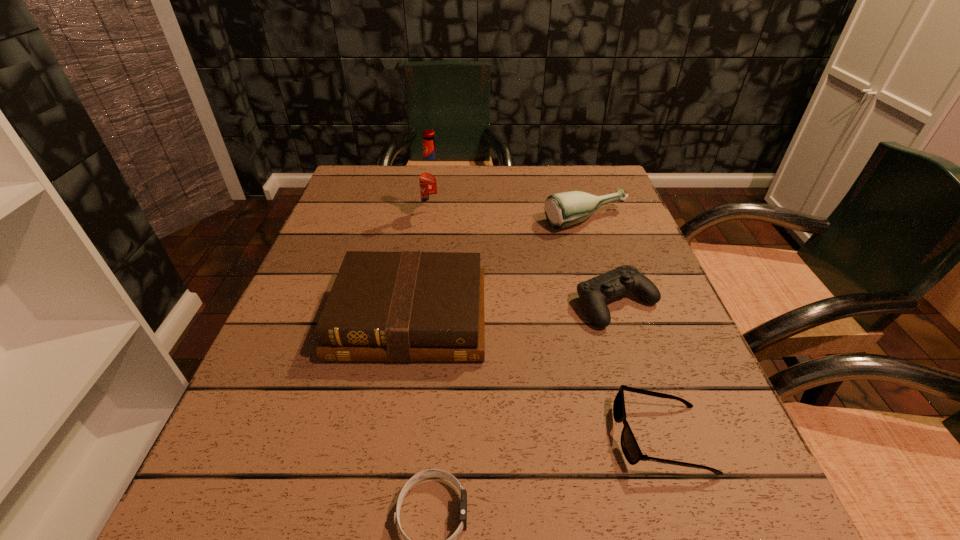
The width and height of the screenshot is (960, 540). I want to click on root beer, so click(x=431, y=175).

You are a GUI agent. You are given a task and a screenshot of the screen. Output one action in this format:
    pyautogui.click(x=<x>, y=<y>)
    Task: Click on the bottle
    
    Given the screenshot: What is the action you would take?
    pyautogui.click(x=564, y=209)

Image resolution: width=960 pixels, height=540 pixels. What are the coordinates of `Bible` in the screenshot? It's located at (411, 306).

Find the location of a particular element. control is located at coordinates click(x=594, y=293).

This screenshot has width=960, height=540. I want to click on sunglasses, so click(631, 450).

You are a GUI agent. You are given a task and a screenshot of the screen. Output one action in this format:
    pyautogui.click(x=<x>, y=<y>)
    Task: Click on the free space located 0.230m on the front of the tallest object
    This screenshot has width=960, height=540.
    Given the screenshot: What is the action you would take?
    pyautogui.click(x=425, y=283)

The image size is (960, 540). In order to click on vacant space located on the left of the bottle in this screenshot , I will do `click(519, 221)`.

This screenshot has width=960, height=540. I want to click on free space located on the spine side of the Bible, so click(x=397, y=395).

Image resolution: width=960 pixels, height=540 pixels. I want to click on vacant point located 0.090m on the front of the control, so click(x=639, y=371).

Where is `free location located on the front-facing side of the sunglasses`? Image resolution: width=960 pixels, height=540 pixels. free location located on the front-facing side of the sunglasses is located at coordinates (511, 437).